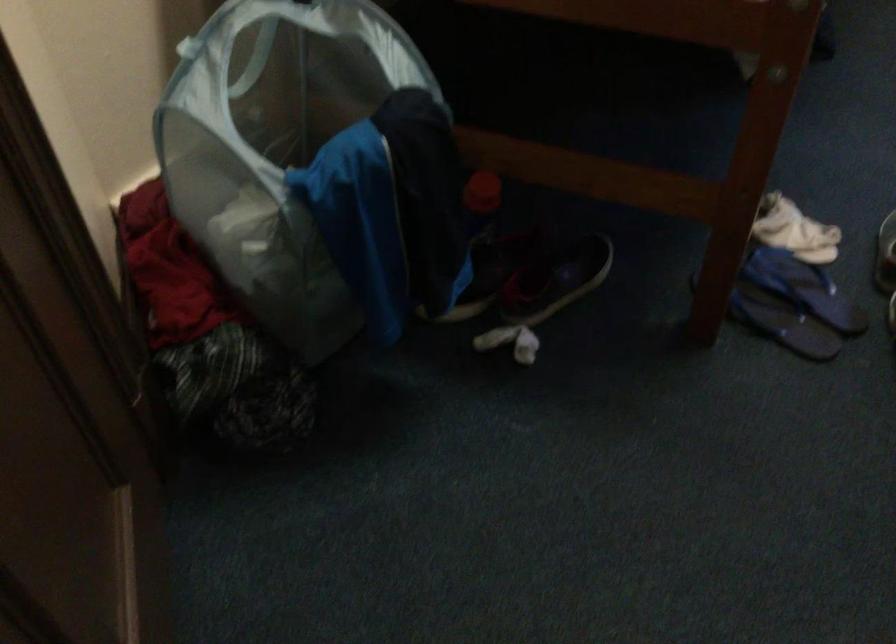
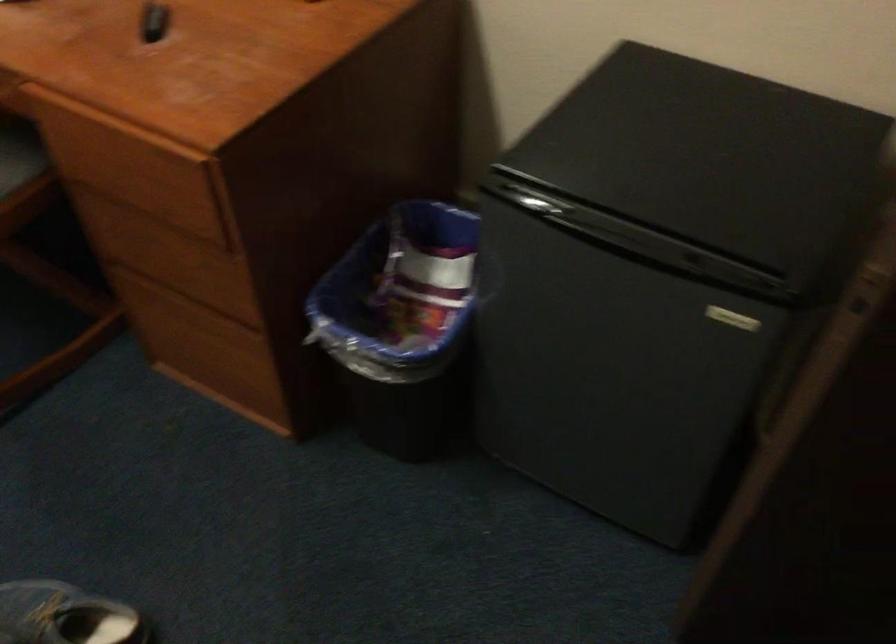
The first image is from the beginning of the video and the second image is from the end. How did the camera likely rotate when shooting the video?

The camera's rotation is toward right-down.